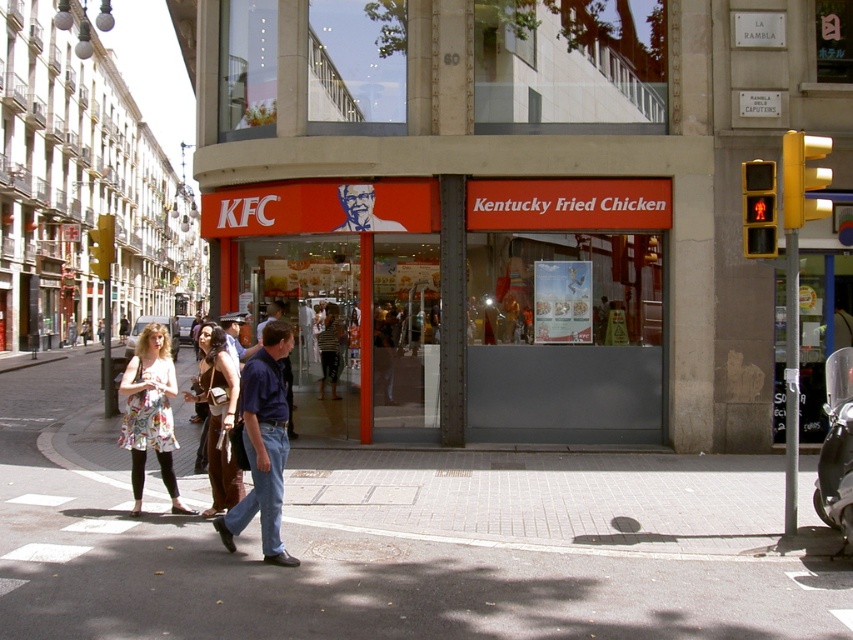
Between floral dress at center and blue denim jeans at center, which one appears on the left side from the viewer's perspective?

Positioned to the left is blue denim jeans at center.

Is point (238, 374) farther from camera compared to point (262, 326)?

No.

Does point (263, 541) lie in front of point (289, 372)?

Yes, point (263, 541) is closer to viewer.

Identify the location of floral dress at center. Image resolution: width=853 pixels, height=640 pixels. (250, 442).

Identify the location of floral dress at center. This screenshot has height=640, width=853. (250, 442).

Can you confirm if floral dress at center is taller than blue jeans at lower center?

Incorrect, floral dress at center's height is not larger of blue jeans at lower center's.

Describe the element at coordinates (250, 442) in the screenshot. The width and height of the screenshot is (853, 640). I see `floral dress at center` at that location.

Locate an element on the screen. This screenshot has height=640, width=853. floral dress at center is located at coordinates (250, 442).

Is brown leather purse at center smaller than blue denim jeans at center?

Indeed, brown leather purse at center has a smaller size compared to blue denim jeans at center.

Image resolution: width=853 pixels, height=640 pixels. What do you see at coordinates (218, 419) in the screenshot? I see `brown leather purse at center` at bounding box center [218, 419].

Locate an element on the screen. This screenshot has height=640, width=853. brown leather purse at center is located at coordinates (218, 419).